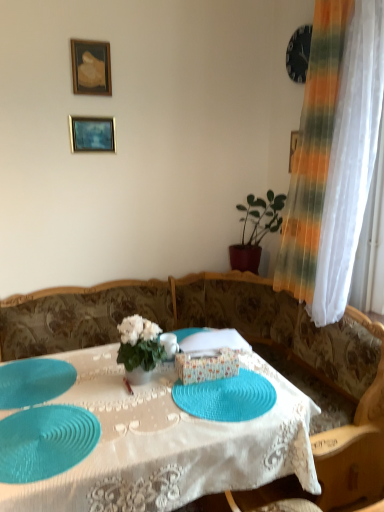
Find the location of a particular element. This screenshot has width=384, height=512. vacant space situated above teal rubber placemat at lower left, the second glass plate in the right-to-left sequence (from a real-world perspective) is located at coordinates (49, 434).